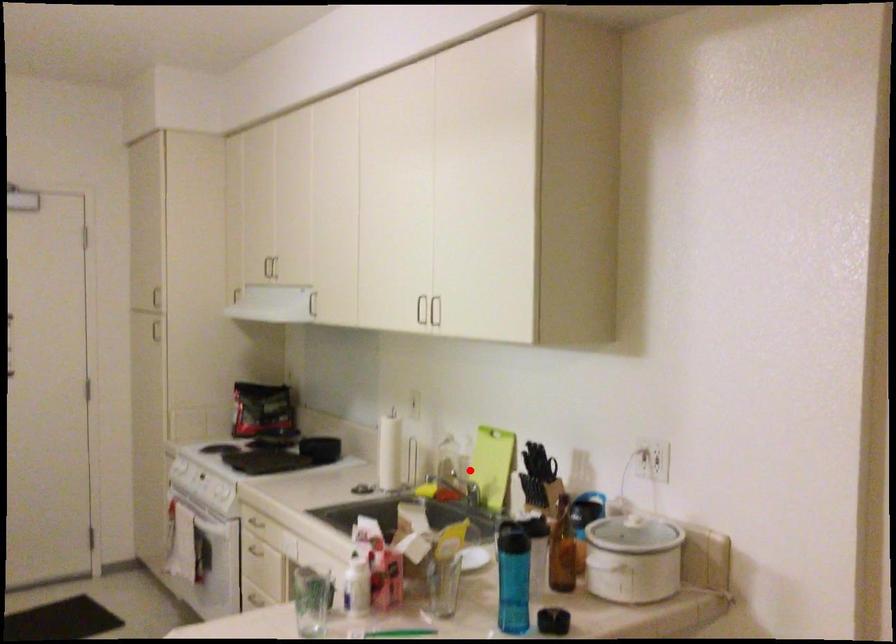
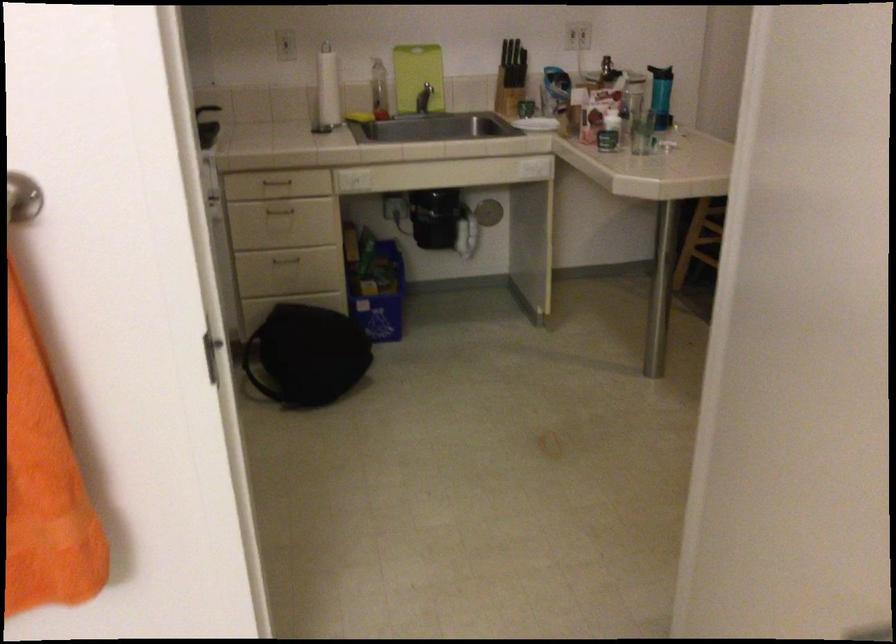
Question: I am providing you with two images of the same scene from different viewpoints. Image1 has a red point marked. In image2, the corresponding 3D location appears at what relative position? Reply with the corresponding letter.

Choices:
 (A) Closer
 (B) Farther

Answer: (B)